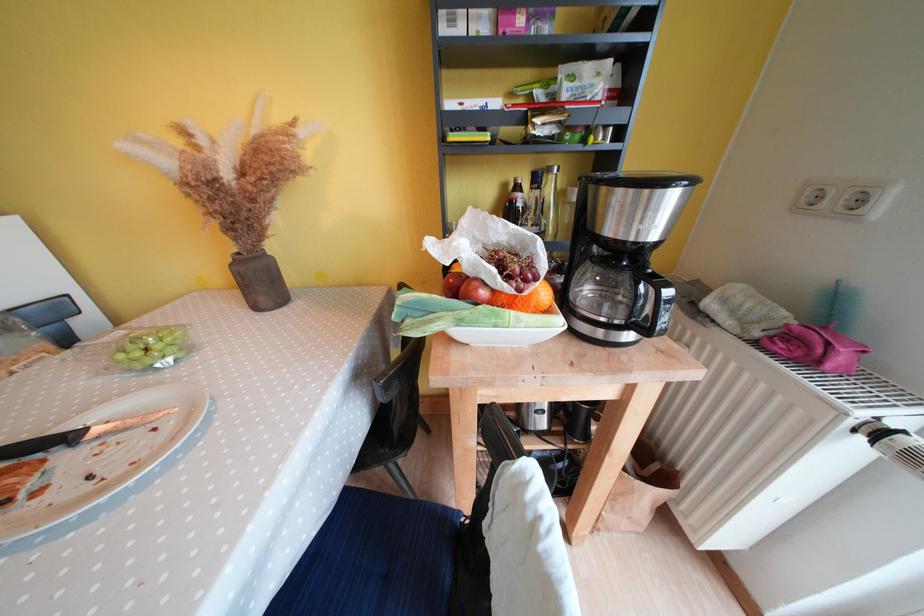
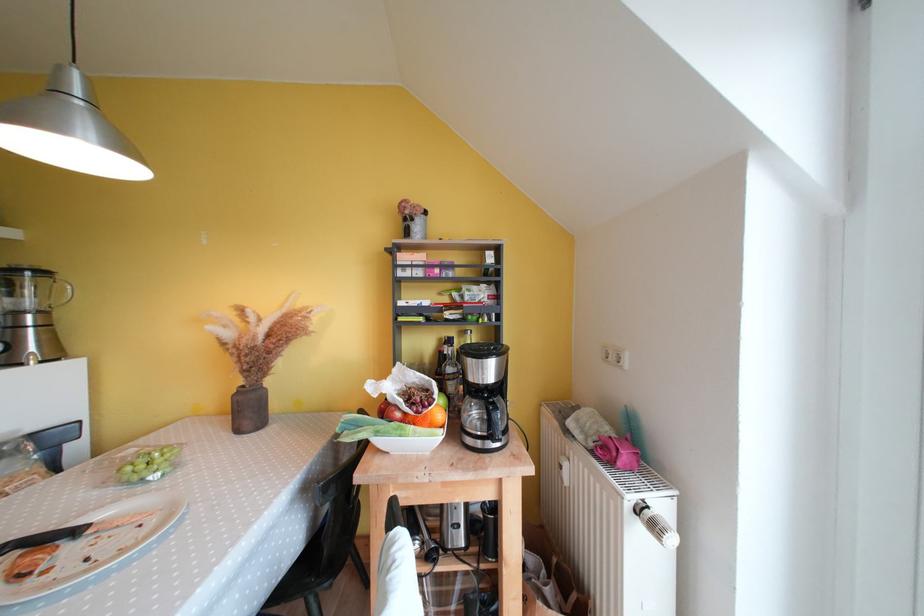
Locate, in the second image, the point that corresponds to [856,426] in the first image.

(634, 509)